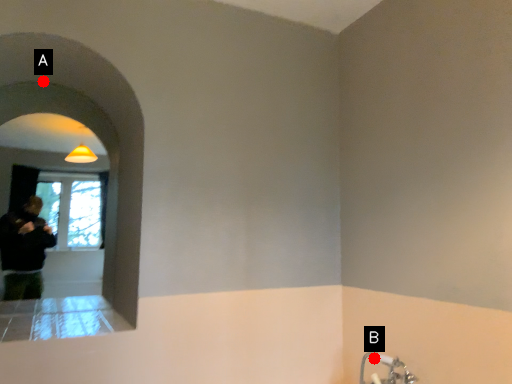
Question: Two points are circled on the image, labeled by A and B beside each circle. Which point is farther to the camera?

Choices:
 (A) A is further
 (B) B is further

Answer: (A)